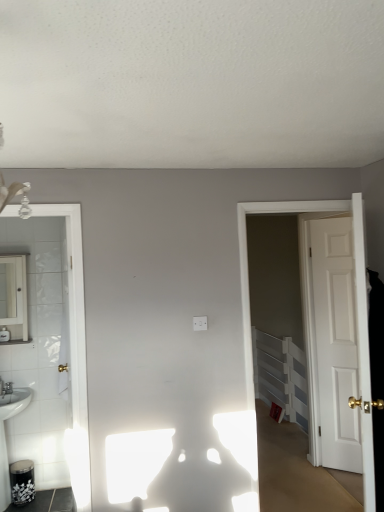
Question: From the image's perspective, would you say white plastic radiator at right is shown under white matte door at right, the 2th door when ordered from left to right?

Choices:
 (A) yes
 (B) no

Answer: (A)

Question: Can you confirm if white plastic radiator at right is smaller than white matte door at right, arranged as the 2th door when viewed from the front?

Choices:
 (A) yes
 (B) no

Answer: (B)

Question: Are white plastic radiator at right and white matte door at right, the 2th door when ordered from left to right, making contact?

Choices:
 (A) yes
 (B) no

Answer: (B)

Question: Is white plastic radiator at right bigger than white matte door at right, the 2th door when ordered from left to right?

Choices:
 (A) yes
 (B) no

Answer: (A)

Question: Can you confirm if white plastic radiator at right is positioned to the right of white matte door at right, the first door from the back?

Choices:
 (A) no
 (B) yes

Answer: (A)

Question: Considering the positions of white glossy mirror at left and white wooden door at right, acting as the 2th door starting from the right, in the image, is white glossy mirror at left taller or shorter than white wooden door at right, acting as the 2th door starting from the right,?

Choices:
 (A) tall
 (B) short

Answer: (B)

Question: Is white glossy mirror at left in front of or behind white wooden door at right, acting as the 2th door starting from the right, in the image?

Choices:
 (A) front
 (B) behind

Answer: (B)

Question: Does point (11, 254) appear closer or farther from the camera than point (365, 312)?

Choices:
 (A) closer
 (B) farther

Answer: (B)

Question: From the image's perspective, is white glossy mirror at left positioned above or below white wooden door at right, which ranks as the 2th door in back-to-front order?

Choices:
 (A) above
 (B) below

Answer: (A)

Question: From the image's perspective, is white wooden door at right, the first door positioned from the left, located above or below white matte door at right, the first door from the back?

Choices:
 (A) above
 (B) below

Answer: (A)

Question: In terms of size, does white wooden door at right, which is counted as the 1th door, starting from the front, appear bigger or smaller than white matte door at right, the 1th door positioned from the right?

Choices:
 (A) big
 (B) small

Answer: (A)

Question: Considering the relative positions of white wooden door at right, acting as the 2th door starting from the right, and white matte door at right, the first door from the back, in the image provided, is white wooden door at right, acting as the 2th door starting from the right, to the left or to the right of white matte door at right, the first door from the back,?

Choices:
 (A) left
 (B) right

Answer: (A)

Question: Would you say white wooden door at right, which ranks as the 2th door in back-to-front order, is inside or outside white matte door at right, the 2th door when ordered from left to right?

Choices:
 (A) outside
 (B) inside

Answer: (A)

Question: Is white glossy mirror at left wider or thinner than white plastic radiator at right?

Choices:
 (A) wide
 (B) thin

Answer: (A)

Question: Considering the positions of white glossy mirror at left and white plastic radiator at right in the image, is white glossy mirror at left taller or shorter than white plastic radiator at right?

Choices:
 (A) tall
 (B) short

Answer: (B)